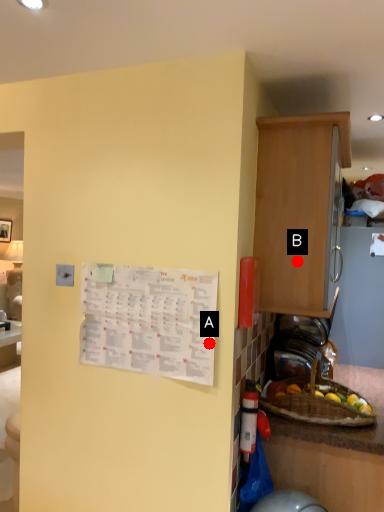
Question: Two points are circled on the image, labeled by A and B beside each circle. Which point is further to the camera?

Choices:
 (A) A is further
 (B) B is further

Answer: (B)